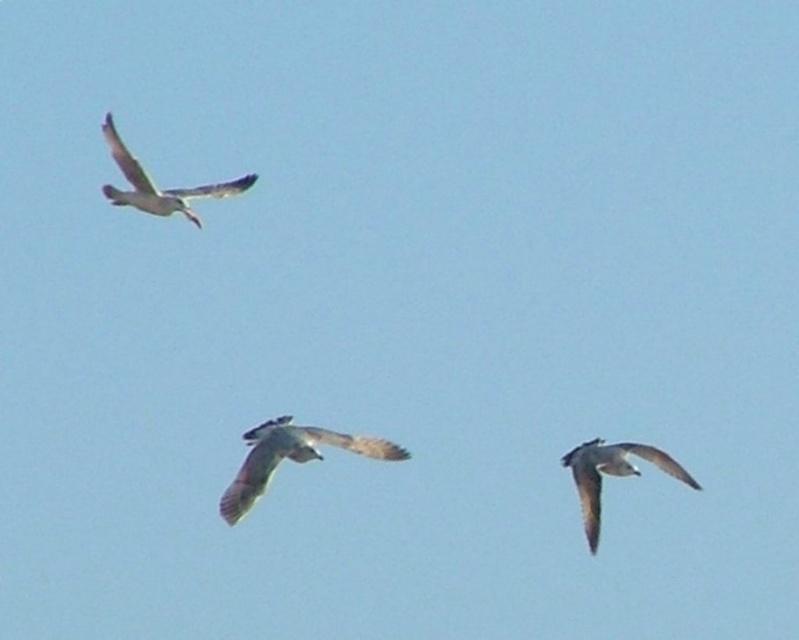
Is point (352, 436) farther from camera compared to point (602, 467)?

No, (352, 436) is closer to viewer.

This screenshot has height=640, width=799. What do you see at coordinates (289, 458) in the screenshot?
I see `light brown feathered bird at center` at bounding box center [289, 458].

You are a GUI agent. You are given a task and a screenshot of the screen. Output one action in this format:
    pyautogui.click(x=<x>, y=<y>)
    Task: Click on the light brown feathered bird at center
    
    Given the screenshot: What is the action you would take?
    pyautogui.click(x=289, y=458)

Is the position of gray feathered bird at lower right more distant than that of speckled feathered bird at upper left?

That is False.

The width and height of the screenshot is (799, 640). Describe the element at coordinates (611, 474) in the screenshot. I see `gray feathered bird at lower right` at that location.

Locate an element on the screen. gray feathered bird at lower right is located at coordinates (611, 474).

You are a GUI agent. You are given a task and a screenshot of the screen. Output one action in this format:
    pyautogui.click(x=<x>, y=<y>)
    Task: Click on the light brown feathered bird at center
    
    Given the screenshot: What is the action you would take?
    pyautogui.click(x=289, y=458)

Locate an element on the screen. This screenshot has width=799, height=640. light brown feathered bird at center is located at coordinates (289, 458).